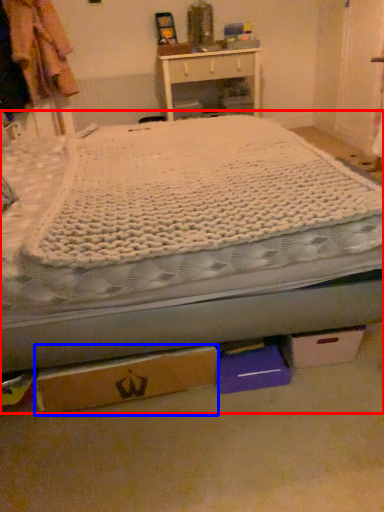
Question: Which point is closer to the camera, bed (highlighted by a red box) or cardboard box (highlighted by a blue box)?

Choices:
 (A) bed
 (B) cardboard box

Answer: (A)